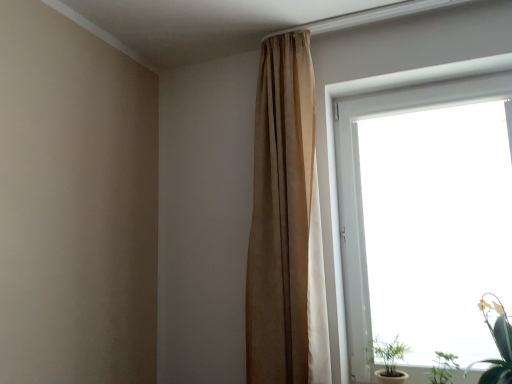
Question: Does transparent glass window at upper right have a greater width compared to green matte plant at lower right, which is counted as the 3th houseplant, starting from the right?

Choices:
 (A) no
 (B) yes

Answer: (A)

Question: From a real-world perspective, is transparent glass window at upper right located higher than green matte plant at lower right, which is counted as the 3th houseplant, starting from the right?

Choices:
 (A) no
 (B) yes

Answer: (B)

Question: Is transparent glass window at upper right with green matte plant at lower right, which is counted as the 3th houseplant, starting from the right?

Choices:
 (A) yes
 (B) no

Answer: (B)

Question: Does transparent glass window at upper right come behind green matte plant at lower right, which is counted as the 3th houseplant, starting from the right?

Choices:
 (A) yes
 (B) no

Answer: (B)

Question: Can green matte plant at lower right, which is counted as the 3th houseplant, starting from the right, be found inside transparent glass window at upper right?

Choices:
 (A) yes
 (B) no

Answer: (A)

Question: Considering the relative sizes of transparent glass window at upper right and green matte plant at lower right, arranged as the first houseplant when viewed from the left, in the image provided, is transparent glass window at upper right shorter than green matte plant at lower right, arranged as the first houseplant when viewed from the left,?

Choices:
 (A) yes
 (B) no

Answer: (B)

Question: Could beige fabric curtain at upper center be considered to be inside green matte plant at lower right, which is counted as the 3th houseplant, starting from the right?

Choices:
 (A) no
 (B) yes

Answer: (A)

Question: From a real-world perspective, does green matte plant at lower right, which is counted as the 3th houseplant, starting from the right, stand above beige fabric curtain at upper center?

Choices:
 (A) yes
 (B) no

Answer: (B)

Question: Is beige fabric curtain at upper center at the back of green matte plant at lower right, which is counted as the 3th houseplant, starting from the right?

Choices:
 (A) yes
 (B) no

Answer: (B)

Question: Is green matte plant at lower right, arranged as the first houseplant when viewed from the left, next to beige fabric curtain at upper center?

Choices:
 (A) no
 (B) yes

Answer: (A)

Question: Does green matte plant at lower right, which is counted as the 3th houseplant, starting from the right, have a lesser width compared to beige fabric curtain at upper center?

Choices:
 (A) yes
 (B) no

Answer: (B)

Question: From a real-world perspective, is green matte plant at lower right, arranged as the first houseplant when viewed from the left, under beige fabric curtain at upper center?

Choices:
 (A) yes
 (B) no

Answer: (A)

Question: Does green leafy plant at lower right, which is the second houseplant from right to left, have a smaller size compared to green leafy plant at lower right, which is counted as the 3th houseplant, starting from the left?

Choices:
 (A) no
 (B) yes

Answer: (B)